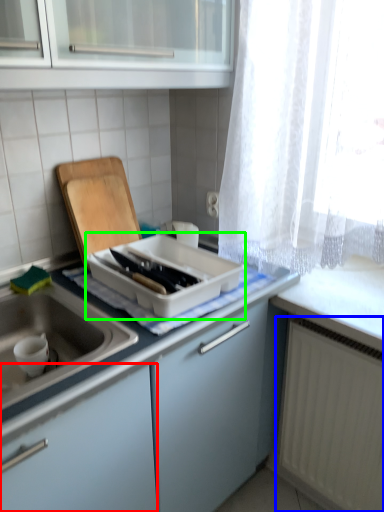
Question: Considering the real-world distances, which object is closest to cabinetry (highlighted by a red box)? radiator (highlighted by a blue box) or kitchen appliance (highlighted by a green box).

Choices:
 (A) radiator
 (B) kitchen appliance

Answer: (B)